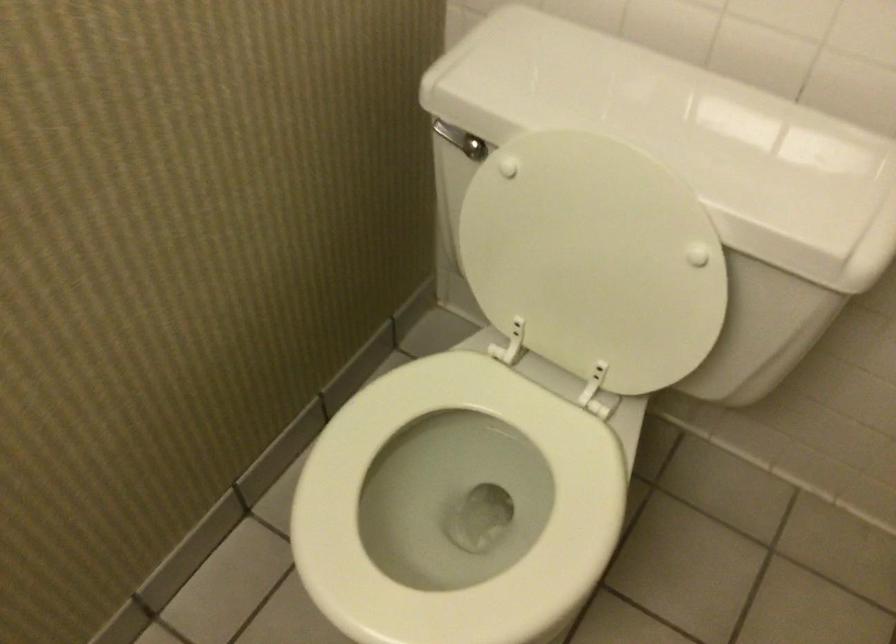
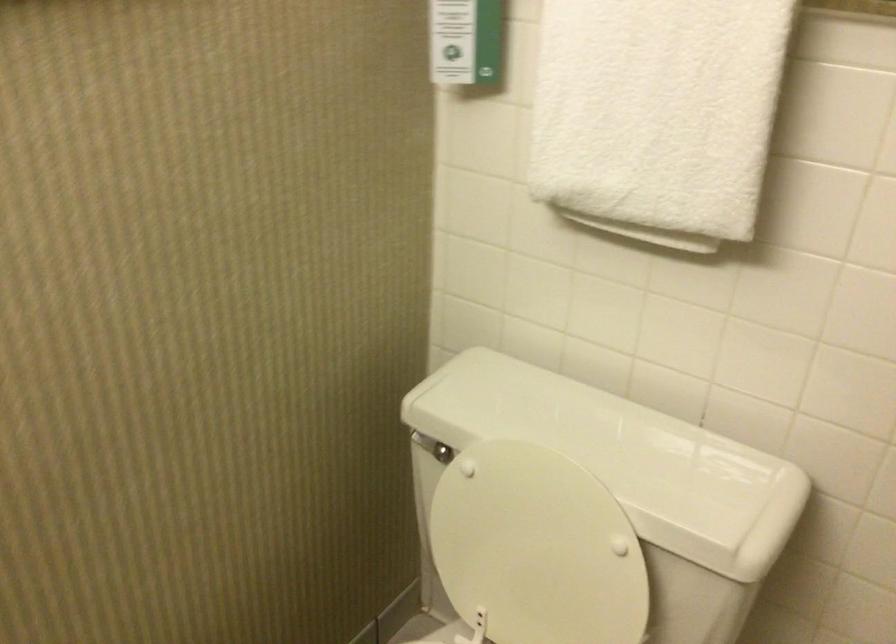
The point at (451, 131) is marked in the first image. Where is the corresponding point in the second image?

(425, 444)